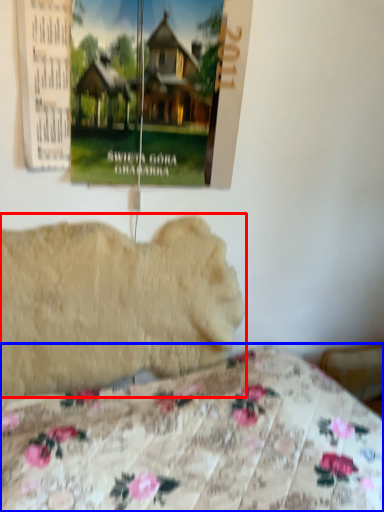
Question: Which point is further to the camera, animal (highlighted by a red box) or bed (highlighted by a blue box)?

Choices:
 (A) animal
 (B) bed

Answer: (A)